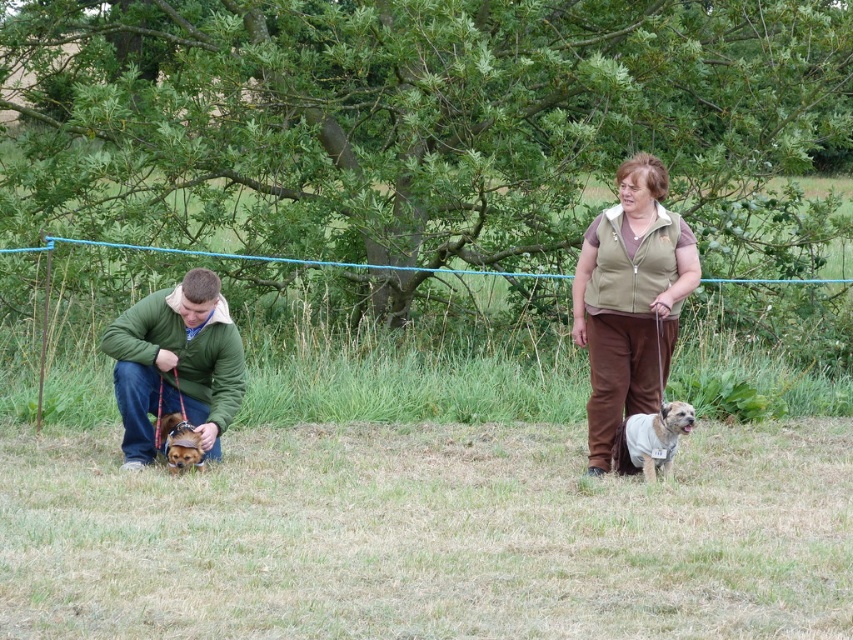
Question: Among these points, which one is farthest from the camera?

Choices:
 (A) (170, 465)
 (B) (144, 401)

Answer: (B)

Question: Where is green matte jacket at lower left located in relation to brown furry dog at lower left in the image?

Choices:
 (A) right
 (B) left

Answer: (B)

Question: Which of the following is the farthest from the observer?

Choices:
 (A) (596, 412)
 (B) (656, 448)

Answer: (A)

Question: Can you confirm if green matte jacket at lower left is positioned below light brown fur at center?

Choices:
 (A) no
 (B) yes

Answer: (A)

Question: Can you confirm if green matte jacket at lower left is wider than light brown fur at center?

Choices:
 (A) yes
 (B) no

Answer: (A)

Question: Estimate the real-world distances between objects in this image. Which object is farther from the green grass at lower center?

Choices:
 (A) light brown fur at center
 (B) green matte jacket at lower left

Answer: (B)